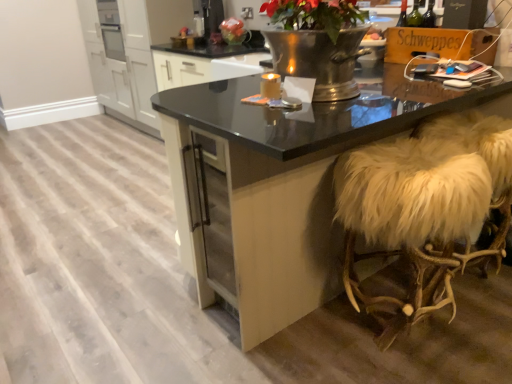
I want to click on vacant space in white fur-covered stool at right (from a real-world perspective), so click(419, 335).